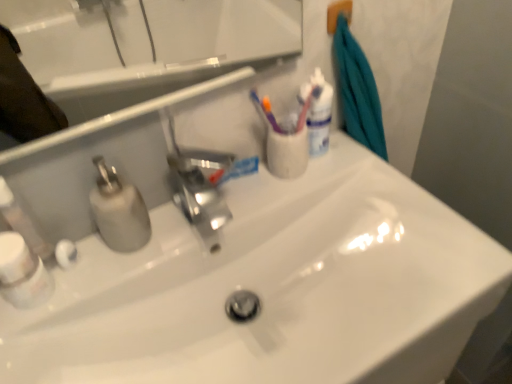
The width and height of the screenshot is (512, 384). I want to click on empty space that is to the right of white plastic bottle at lower left, the second mouthwash positioned from the right, so click(x=129, y=263).